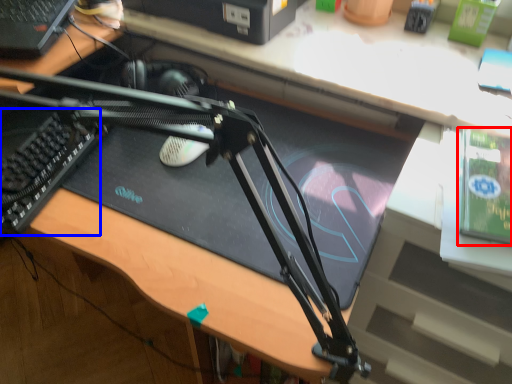
Question: Which object is closer to the camera taking this photo, paperback book (highlighted by a red box) or laptop keyboard (highlighted by a blue box)?

Choices:
 (A) paperback book
 (B) laptop keyboard

Answer: (A)